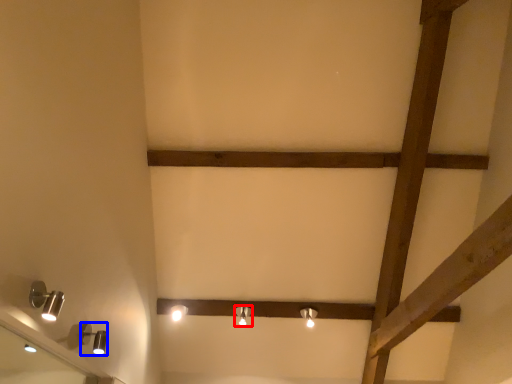
Question: Among these objects, which one is nearest to the camera, lamp (highlighted by a red box) or lamp (highlighted by a blue box)?

Choices:
 (A) lamp
 (B) lamp

Answer: (B)